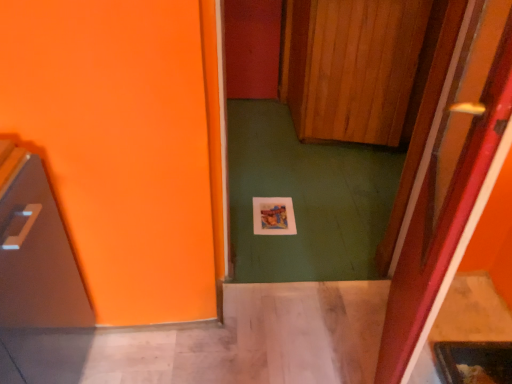
Question: Is shiny metallic microwave at left inside the boundaries of wooden at center, the first door viewed from the top, or outside?

Choices:
 (A) outside
 (B) inside

Answer: (A)

Question: From the image's perspective, is shiny metallic microwave at left positioned above or below wooden at center, the first door viewed from the top?

Choices:
 (A) above
 (B) below

Answer: (B)

Question: Which is nearer to the shiny metallic microwave at left?

Choices:
 (A) wooden at center, the first door viewed from the top
 (B) wooden at center, acting as the 1th door starting from the bottom

Answer: (B)

Question: Estimate the real-world distances between objects in this image. Which object is farther from the wooden at center, the second door when ordered from back to front?

Choices:
 (A) shiny metallic microwave at left
 (B) wooden at center, the first door viewed from the top

Answer: (B)